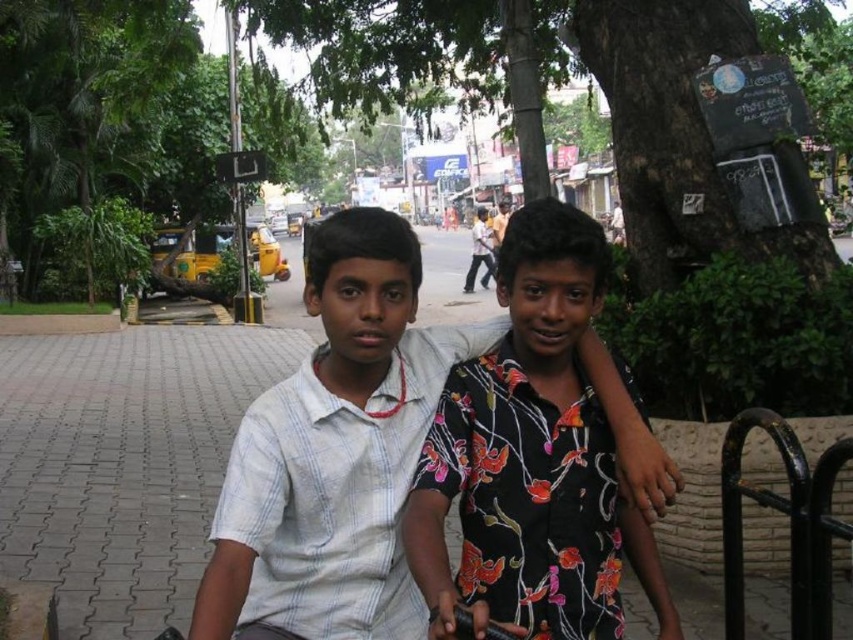
You are a photographer trying to capture a photo of the two boys without any obstructions. The green leafy tree at center and the black metal rail at lower right are in the background. Which object would block the view of the boys if placed between them and the camera?

The green leafy tree at center is much taller than the black metal rail at lower right, so if placed between the camera and the boys, the green leafy tree at center would block the view more significantly than the black metal rail at lower right.

You are standing at the point with coordinates point [498,548] and want to walk to the point with coordinates point [824,586]. Which direction should you move? The two points are in an urban area with two boys and parked auto rickshaws.

You should move backward because point [498,548] is in front of point [824,586], meaning point [824,586] is behind point [498,548].

Based on the photo, you are a photographer trying to capture a wide shot of the two boys and their surroundings. Given that the green leafy tree at center and the black metal rail at lower right are in your frame, which object would require you to adjust your camera angle to include its full width in the photo?

The green leafy tree at center has a larger width than the black metal rail at lower right, so you would need to adjust your camera angle to include its full width in the photo.